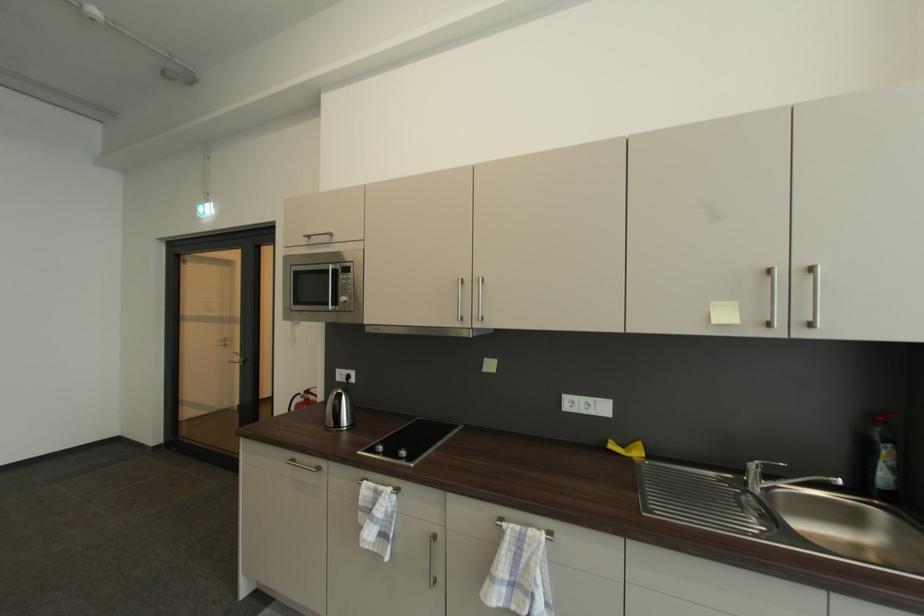
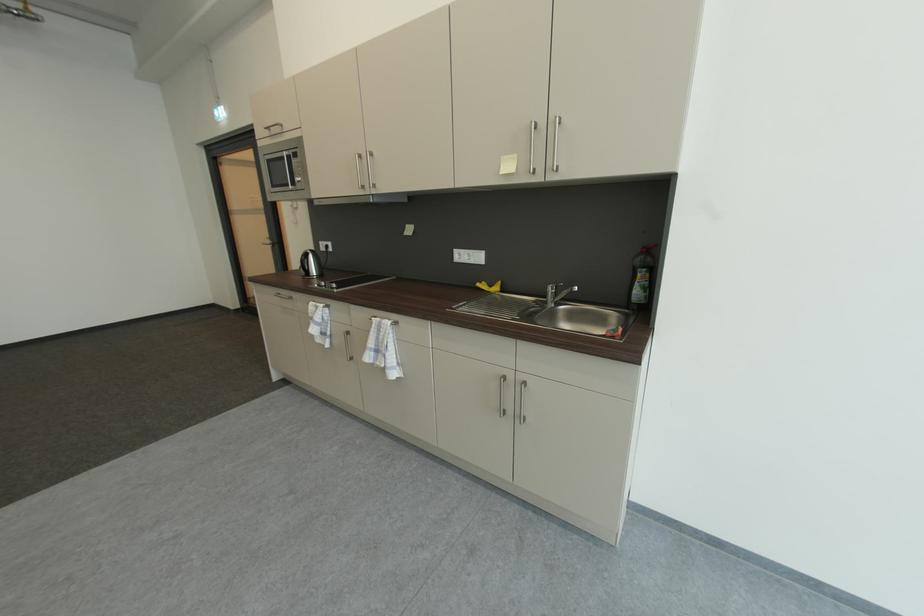
Locate, in the second image, the point that corresponds to pixel 311 237 in the first image.

(273, 130)